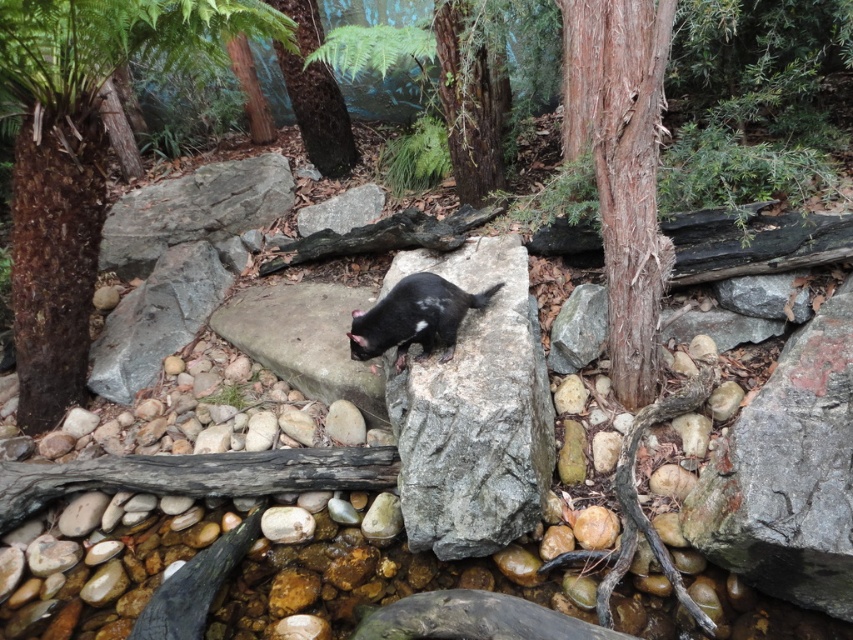
You are a park ranger trying to identify two brown trees in the scene. Which tree is bigger between the brown rough tree at center and the brown rough bark tree at upper center?

The brown rough tree at center is larger in size than the brown rough bark tree at upper center.